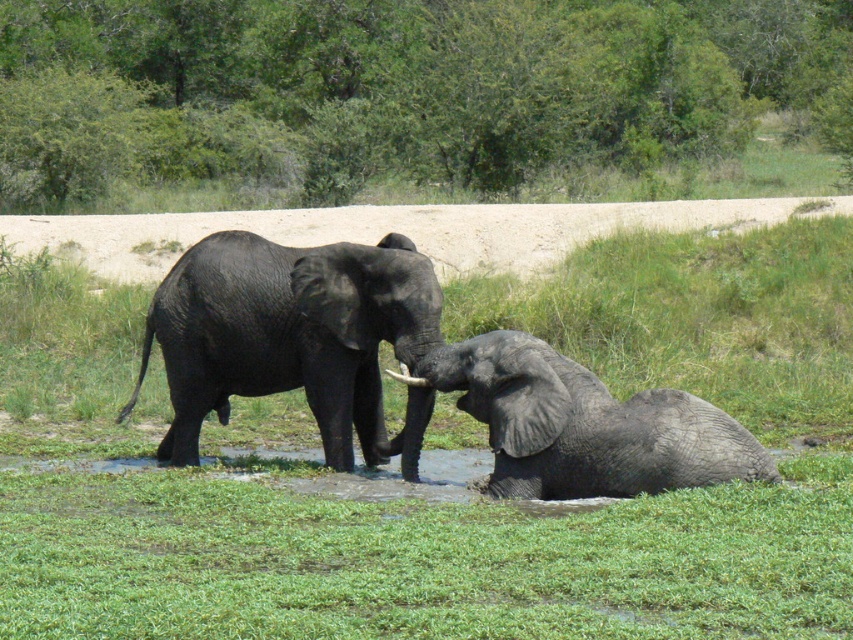
Between point (700, 376) and point (267, 337), which one is positioned behind?

Positioned behind is point (700, 376).

Is green grassy at center taller than shiny black elephant at center?

Indeed, green grassy at center has a greater height compared to shiny black elephant at center.

Describe the element at coordinates (503, 506) in the screenshot. I see `green grassy at center` at that location.

Locate an element on the screen. green grassy at center is located at coordinates (503, 506).

Does green grassy at center appear on the left side of gray matte elephant at lower right?

Indeed, green grassy at center is positioned on the left side of gray matte elephant at lower right.

Is green grassy at center in front of gray matte elephant at lower right?

Yes, green grassy at center is in front of gray matte elephant at lower right.

Measure the distance between point [91,355] and camera.

The distance of point [91,355] from camera is 20.18 meters.

Find the location of a particular element. green grassy at center is located at coordinates (503, 506).

Which is more to the right, shiny black elephant at center or white ivory tusk at upper center?

white ivory tusk at upper center

Is shiny black elephant at center above white ivory tusk at upper center?

Correct, shiny black elephant at center is located above white ivory tusk at upper center.

Between point (244, 280) and point (402, 372), which one is positioned in front?

Point (402, 372) is in front.

Find the location of a particular element. The height and width of the screenshot is (640, 853). shiny black elephant at center is located at coordinates (293, 337).